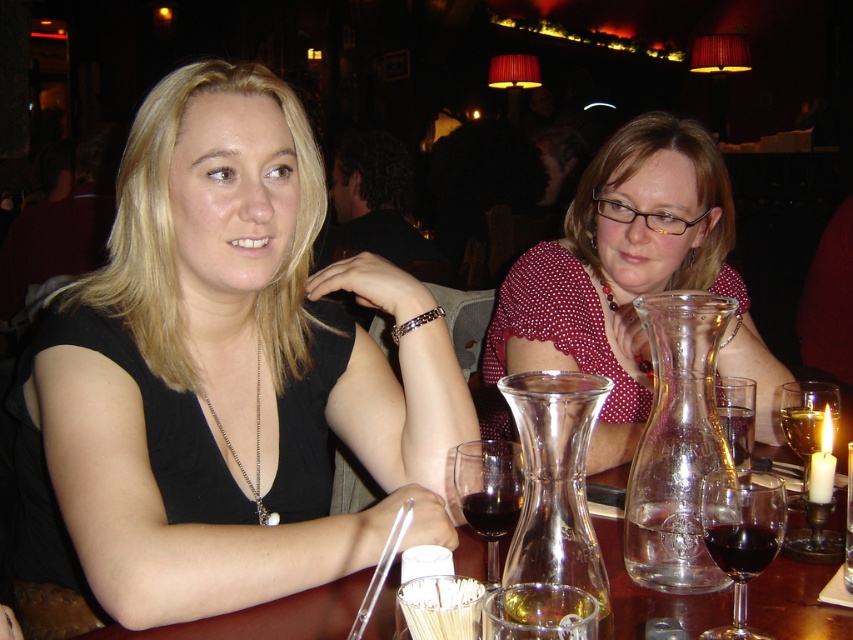
You are a server at the restaurant and need to place a dessert plate between the black matte dress at center and the clear glass wine glass at center. Considering their positions and sizes, can you fit the plate there without it overlapping either object?

The black matte dress at center is taller than the clear glass wine glass at center. Since the dessert plate needs space between them, the height difference might allow placement, but exact positioning depends on their horizontal distance apart which isn

You are a waiter in a restaurant. You need to deliver a drink to the person on the right. The ruby glass at table center is located at point 0.836, 0.870. The person on the right is seated at point 0.950, 0.870. Which direction should you move the glass to reach the person on the right?

The ruby glass at table center is located at point (741,534), and the person on the right is seated at point (741,608). Since both have the same y coordinate of 0.870, the x coordinate of the glass is lower than the person. Therefore, you should move the glass to the right to reach the person on the right.

You are a server at the restaurant and need to place a 10 inch wide dessert plate between the black matte dress at center and the clear glass wine glass at center. Can you fit it there?

The black matte dress at center and clear glass wine glass at center are 21.13 inches apart, so yes, the dessert plate can be placed between them since 21.13 inches is more than enough space for a 10 inch wide plate.